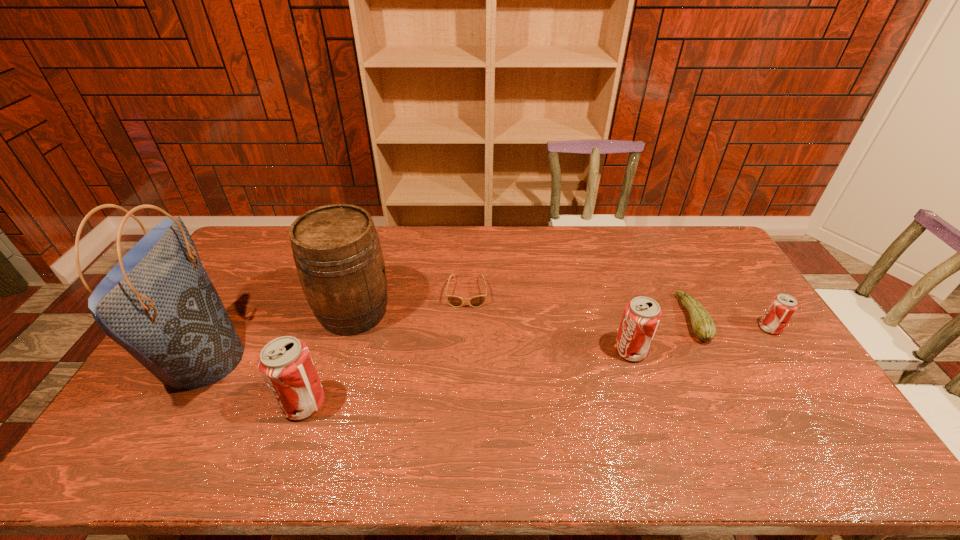
Where is `free spot that satisfies the following two spatial constraints: 1. on the side of the second tallest object near the bung hole; 2. on the left side of the second nearest soda can`? Image resolution: width=960 pixels, height=540 pixels. free spot that satisfies the following two spatial constraints: 1. on the side of the second tallest object near the bung hole; 2. on the left side of the second nearest soda can is located at coordinates (342, 350).

I want to click on free point that satisfies the following two spatial constraints: 1. on the back side of the rightmost object; 2. on the left side of the leftmost object, so click(x=222, y=328).